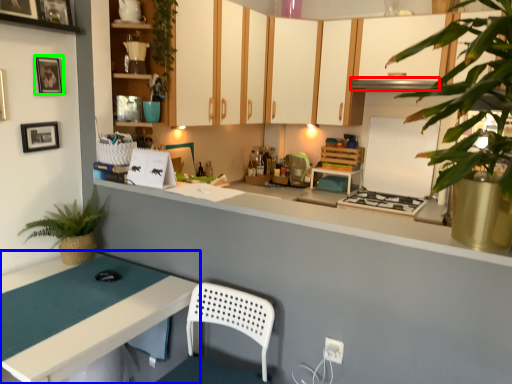
Question: Which object is positioned farthest from exhaust hood (highlighted by a red box)? Select from table (highlighted by a blue box) and picture frame (highlighted by a green box).

Choices:
 (A) table
 (B) picture frame

Answer: (A)